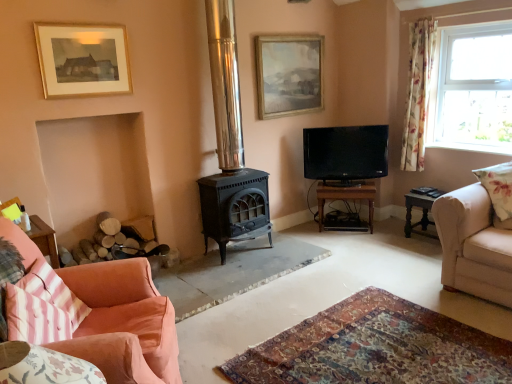
Question: Considering the relative sizes of pink striped cushion at lower left, the second pillow in the top-to-bottom sequence, and black glossy tv at center in the image provided, is pink striped cushion at lower left, the second pillow in the top-to-bottom sequence, bigger than black glossy tv at center?

Choices:
 (A) no
 (B) yes

Answer: (A)

Question: Does pink striped cushion at lower left, which is the 1th pillow from front to back, lie in front of black glossy tv at center?

Choices:
 (A) no
 (B) yes

Answer: (B)

Question: Considering the relative positions of pink striped cushion at lower left, the second pillow in the top-to-bottom sequence, and black glossy tv at center in the image provided, is pink striped cushion at lower left, the second pillow in the top-to-bottom sequence, behind black glossy tv at center?

Choices:
 (A) yes
 (B) no

Answer: (B)

Question: Is pink striped cushion at lower left, which is the 1th pillow from front to back, next to black glossy tv at center and touching it?

Choices:
 (A) no
 (B) yes

Answer: (A)

Question: Considering the relative sizes of pink striped cushion at lower left, acting as the first pillow starting from the bottom, and black glossy tv at center in the image provided, is pink striped cushion at lower left, acting as the first pillow starting from the bottom, shorter than black glossy tv at center?

Choices:
 (A) no
 (B) yes

Answer: (B)

Question: Is brown wooden table at center, the first table viewed from the left, taller or shorter than floral fabric curtain at right?

Choices:
 (A) tall
 (B) short

Answer: (B)

Question: From the image's perspective, is brown wooden table at center, the first table viewed from the left, located above or below floral fabric curtain at right?

Choices:
 (A) below
 (B) above

Answer: (A)

Question: Based on their positions, is brown wooden table at center, the second table when ordered from right to left, located to the left or right of floral fabric curtain at right?

Choices:
 (A) right
 (B) left

Answer: (B)

Question: Based on their sizes in the image, would you say brown wooden table at center, the second table when ordered from right to left, is bigger or smaller than floral fabric curtain at right?

Choices:
 (A) small
 (B) big

Answer: (B)

Question: Is point (498, 205) positioned closer to the camera than point (321, 134)?

Choices:
 (A) farther
 (B) closer

Answer: (B)

Question: From a real-world perspective, is floral fabric cushion at right, the first pillow in the back-to-front sequence, physically located above or below black glossy tv at center?

Choices:
 (A) above
 (B) below

Answer: (B)

Question: Based on their sizes in the image, would you say floral fabric cushion at right, which is the first pillow in right-to-left order, is bigger or smaller than black glossy tv at center?

Choices:
 (A) big
 (B) small

Answer: (B)

Question: Is floral fabric cushion at right, the second pillow when ordered from bottom to top, in front of or behind black glossy tv at center in the image?

Choices:
 (A) behind
 (B) front

Answer: (B)

Question: From a real-world perspective, is beige fabric couch at right, which is the first studio couch from right to left, positioned above or below dark gray wooden side table at right, positioned as the second table in left-to-right order?

Choices:
 (A) above
 (B) below

Answer: (A)

Question: Is beige fabric couch at right, which is the first studio couch from right to left, situated inside dark gray wooden side table at right, the 1th table when ordered from right to left, or outside?

Choices:
 (A) inside
 (B) outside

Answer: (B)